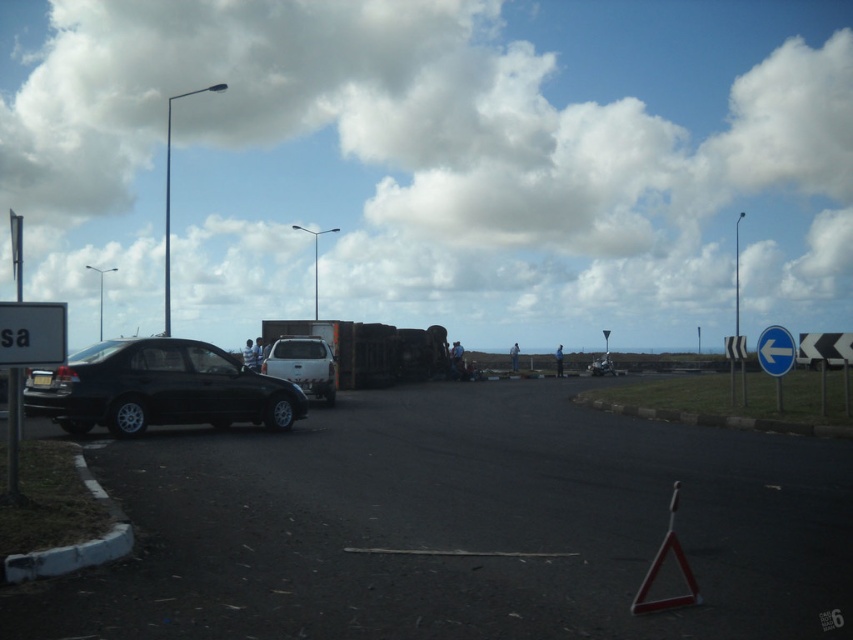
Is point (189, 403) behind point (25, 320)?

Yes, point (189, 403) is behind point (25, 320).

Which is behind, point (192, 412) or point (62, 332)?

Positioned behind is point (192, 412).

Identify the location of matte black car at left. (158, 388).

Between point (515, 612) and point (15, 344), which one is positioned in front?

Point (515, 612) is more forward.

This screenshot has width=853, height=640. Identify the location of black asphalt parking lot at lower left. (457, 525).

The image size is (853, 640). In order to click on black asphalt parking lot at lower left in this screenshot , I will do [457, 525].

Between point (126, 436) and point (788, 362), which one is positioned behind?

Positioned behind is point (788, 362).

Between matte black car at left and blue plastic sign at right, which one has less height?

blue plastic sign at right

Is point (57, 416) closer to camera compared to point (759, 362)?

Yes.

This screenshot has width=853, height=640. Identify the location of matte black car at left. (158, 388).